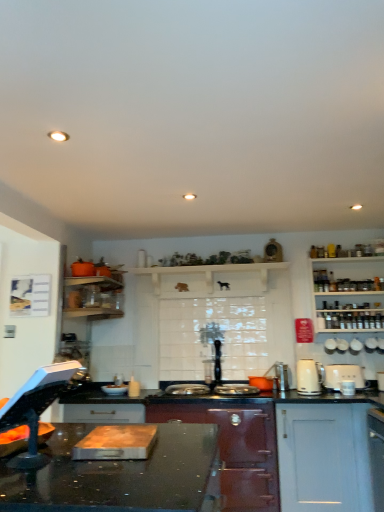
Locate an element on the screen. orange matte pot at center, positioned as the fifth appliance in right-to-left order is located at coordinates (263, 383).

Looking at this image, in order to face black glossy countertop at center, should I rotate leftwards or rightwards?

You should look left and rotate roughly 13.539 degrees.

Image resolution: width=384 pixels, height=512 pixels. What do you see at coordinates (117, 475) in the screenshot? I see `black glossy countertop at center` at bounding box center [117, 475].

Image resolution: width=384 pixels, height=512 pixels. I want to click on white ceramic toaster at upper right, placed as the third appliance when sorted from left to right, so click(x=342, y=345).

The image size is (384, 512). What do you see at coordinates (343, 376) in the screenshot? I see `white plastic toaster at right, the first kitchen appliance viewed from the right` at bounding box center [343, 376].

What do you see at coordinates (370, 344) in the screenshot? This screenshot has height=512, width=384. I see `white ceramic mug at upper right, which ranks as the 5th appliance in left-to-right order` at bounding box center [370, 344].

Describe the element at coordinates (330, 346) in the screenshot. This screenshot has height=512, width=384. I see `white ceramic kettle at upper right, arranged as the 4th appliance when viewed from the right` at that location.

Image resolution: width=384 pixels, height=512 pixels. I want to click on white wooden shelves at right, so click(349, 294).

Where is `orange matte pot at center, positioned as the fifth appliance in right-to-left order`? orange matte pot at center, positioned as the fifth appliance in right-to-left order is located at coordinates pos(263,383).

Can you confirm if white plastic toaster at right, which is the second kitchen appliance in left-to-right order, is bigger than white wooden shelves at right?

No.

From a real-world perspective, is white plastic toaster at right, the first kitchen appliance viewed from the right, beneath white wooden shelves at right?

Indeed, from a real-world perspective, white plastic toaster at right, the first kitchen appliance viewed from the right, is positioned beneath white wooden shelves at right.

Can you confirm if white plastic toaster at right, the first kitchen appliance viewed from the right, is positioned to the right of white wooden shelves at right?

In fact, white plastic toaster at right, the first kitchen appliance viewed from the right, is to the left of white wooden shelves at right.

From a real-world perspective, is white ceramic mug at upper right, arranged as the 1th appliance when viewed from the right, located higher than black glossy countertop at center?

Yes, from a real-world perspective, white ceramic mug at upper right, arranged as the 1th appliance when viewed from the right, is on top of black glossy countertop at center.

Between white ceramic mug at upper right, arranged as the 1th appliance when viewed from the right, and black glossy countertop at center, which one is positioned in front?

Positioned in front is black glossy countertop at center.

Is white ceramic mug at upper right, which ranks as the 5th appliance in left-to-right order, completely or partially outside of black glossy countertop at center?

white ceramic mug at upper right, which ranks as the 5th appliance in left-to-right order, is positioned outside black glossy countertop at center.

From a real-world perspective, which object rests below the other?

white matte cabinet at lower right, the 2th cabinetry viewed from the left, from a real-world perspective.

Considering the relative sizes of white matte cabinet at lower right, the 2th cabinetry viewed from the left, and matte dark red stove at center, the second cabinetry viewed from the right, in the image provided, is white matte cabinet at lower right, the 2th cabinetry viewed from the left, thinner than matte dark red stove at center, the second cabinetry viewed from the right,?

Correct, the width of white matte cabinet at lower right, the 2th cabinetry viewed from the left, is less than that of matte dark red stove at center, the second cabinetry viewed from the right.

Is white matte cabinet at lower right, the 2th cabinetry viewed from the left, at the right side of matte dark red stove at center, the second cabinetry viewed from the right?

Yes, white matte cabinet at lower right, the 2th cabinetry viewed from the left, is to the right of matte dark red stove at center, the second cabinetry viewed from the right.

You are a GUI agent. You are given a task and a screenshot of the screen. Output one action in this format:
    pyautogui.click(x=<x>, y=<y>)
    Task: Click on the cabinetry that appears in front of the matte dark red stove at center, the first cabinetry in the left-to-right sequence
    This screenshot has height=512, width=384.
    Given the screenshot: What is the action you would take?
    pyautogui.click(x=324, y=457)

Considering the sizes of objects black glossy countertop at center and white plastic toaster at right, the first kitchen appliance viewed from the right, in the image provided, who is smaller, black glossy countertop at center or white plastic toaster at right, the first kitchen appliance viewed from the right,?

With smaller size is white plastic toaster at right, the first kitchen appliance viewed from the right.

Considering the relative sizes of black glossy countertop at center and white plastic toaster at right, which is the second kitchen appliance in left-to-right order, in the image provided, is black glossy countertop at center thinner than white plastic toaster at right, which is the second kitchen appliance in left-to-right order,?

No.

From the image's perspective, is black glossy countertop at center located beneath white plastic toaster at right, which is the second kitchen appliance in left-to-right order?

Correct, black glossy countertop at center appears lower than white plastic toaster at right, which is the second kitchen appliance in left-to-right order, in the image.

Is point (90, 488) positioned in front of point (358, 378)?

That is True.

How many degrees apart are the facing directions of matte dark red stove at center, the second cabinetry viewed from the right, and orange matte pot at center, placed as the 1th appliance when sorted from left to right?

They differ by 2.14 degrees in their facing directions.

Is point (152, 410) positioned behind point (254, 377)?

That is False.

Does matte dark red stove at center, the first cabinetry in the left-to-right sequence, have a greater height compared to orange matte pot at center, positioned as the fifth appliance in right-to-left order?

Yes, matte dark red stove at center, the first cabinetry in the left-to-right sequence, is taller than orange matte pot at center, positioned as the fifth appliance in right-to-left order.

Measure the distance between matte dark red stove at center, the first cabinetry in the left-to-right sequence, and orange matte pot at center, positioned as the fifth appliance in right-to-left order.

They are 17.42 inches apart.

From a real-world perspective, is white wooden shelves at right positioned above or below white ceramic cups at upper right, which is the fourth appliance in left-to-right order?

white wooden shelves at right is above white ceramic cups at upper right, which is the fourth appliance in left-to-right order.

Is white wooden shelves at right bigger than white ceramic cups at upper right, the second appliance when ordered from right to left?

Yes, white wooden shelves at right is bigger than white ceramic cups at upper right, the second appliance when ordered from right to left.

In order to click on the 4th appliance directly beneath the white wooden shelves at right (from a real-world perspective) in this screenshot , I will do `click(356, 345)`.

Is the surface of white ceramic toaster at upper right, arranged as the third appliance when viewed from the right, in direct contact with white ceramic cups at upper right, which is the fourth appliance in left-to-right order?

Yes, white ceramic toaster at upper right, arranged as the third appliance when viewed from the right, is with white ceramic cups at upper right, which is the fourth appliance in left-to-right order.

From a real-world perspective, who is located higher, white ceramic toaster at upper right, placed as the third appliance when sorted from left to right, or white ceramic cups at upper right, which is the fourth appliance in left-to-right order?

In real-world perspective, white ceramic toaster at upper right, placed as the third appliance when sorted from left to right, is above.

Which is more to the left, white ceramic toaster at upper right, arranged as the third appliance when viewed from the right, or white ceramic cups at upper right, which is the fourth appliance in left-to-right order?

Positioned to the left is white ceramic toaster at upper right, arranged as the third appliance when viewed from the right.

Does point (348, 347) come farther from viewer compared to point (355, 351)?

That is True.

The image size is (384, 512). I want to click on the 1st kitchen appliance in front of the white wooden shelves at right, starting your count from the anchor, so click(x=343, y=376).

At what (x,y) coordinates should I click in order to perform the action: click on the 4th appliance located above the black glossy countertop at center (from a real-world perspective). Please return your answer as a coordinate pair (x, y). The height and width of the screenshot is (512, 384). Looking at the image, I should click on (370, 344).

Looking at the image, which one is located further to white glossy kettle at center-right, acting as the second kitchen appliance starting from the right, white wooden shelves at right or white matte cabinet at lower right, the first cabinetry from the right?

white wooden shelves at right.

Looking at the image, which one is located further to white matte cabinet at lower right, the first cabinetry from the right, white wooden shelves at right or matte dark red stove at center, the first cabinetry in the left-to-right sequence?

The object further to white matte cabinet at lower right, the first cabinetry from the right, is white wooden shelves at right.

Considering their positions, is white plastic toaster at right, which is the second kitchen appliance in left-to-right order, positioned closer to matte dark red stove at center, the first cabinetry in the left-to-right sequence, than white ceramic cups at upper right, which is the fourth appliance in left-to-right order?

The object closer to matte dark red stove at center, the first cabinetry in the left-to-right sequence, is white plastic toaster at right, which is the second kitchen appliance in left-to-right order.

Looking at the image, which one is located further to white glossy kettle at center-right, placed as the 1th kitchen appliance when sorted from left to right, white matte cabinet at lower right, the first cabinetry from the right, or white ceramic cups at upper right, the second appliance when ordered from right to left?

The object further to white glossy kettle at center-right, placed as the 1th kitchen appliance when sorted from left to right, is white ceramic cups at upper right, the second appliance when ordered from right to left.

From the picture: Based on their spatial positions, is white glossy kettle at center-right, placed as the 1th kitchen appliance when sorted from left to right, or white ceramic cups at upper right, the second appliance when ordered from right to left, further from white plastic toaster at right, the first kitchen appliance viewed from the right?

The object further to white plastic toaster at right, the first kitchen appliance viewed from the right, is white ceramic cups at upper right, the second appliance when ordered from right to left.

From the image, which object appears to be farther from white ceramic mug at upper right, arranged as the 1th appliance when viewed from the right, white ceramic toaster at upper right, placed as the third appliance when sorted from left to right, or white plastic toaster at right, the first kitchen appliance viewed from the right?

Among the two, white plastic toaster at right, the first kitchen appliance viewed from the right, is located further to white ceramic mug at upper right, arranged as the 1th appliance when viewed from the right.

When comparing their distances from white ceramic cups at upper right, the second appliance when ordered from right to left, does white matte cabinet at lower right, the first cabinetry from the right, or matte dark red stove at center, the second cabinetry viewed from the right, seem further?

matte dark red stove at center, the second cabinetry viewed from the right, is further to white ceramic cups at upper right, the second appliance when ordered from right to left.

Looking at the image, which one is located further to white wooden shelves at right, matte dark red stove at center, the second cabinetry viewed from the right, or white glossy kettle at center-right, acting as the second kitchen appliance starting from the right?

matte dark red stove at center, the second cabinetry viewed from the right.

Identify the location of cabinetry between matte dark red stove at center, the first cabinetry in the left-to-right sequence, and white ceramic kettle at upper right, which ranks as the second appliance in left-to-right order, from left to right. (324, 457).

You are a GUI agent. You are given a task and a screenshot of the screen. Output one action in this format:
    pyautogui.click(x=<x>, y=<y>)
    Task: Click on the appliance between white ceramic kettle at upper right, arranged as the 4th appliance when viewed from the right, and white ceramic cups at upper right, the second appliance when ordered from right to left
    
    Given the screenshot: What is the action you would take?
    pyautogui.click(x=342, y=345)

The height and width of the screenshot is (512, 384). What are the coordinates of `appliance between orange matte pot at center, positioned as the fifth appliance in right-to-left order, and white plastic toaster at right, which is the second kitchen appliance in left-to-right order, from left to right` in the screenshot? It's located at (330, 346).

Find the location of a particular element. Image resolution: width=384 pixels, height=512 pixels. kitchen appliance between white glossy kettle at center-right, placed as the 1th kitchen appliance when sorted from left to right, and white ceramic kettle at upper right, arranged as the 4th appliance when viewed from the right, from front to back is located at coordinates (343, 376).